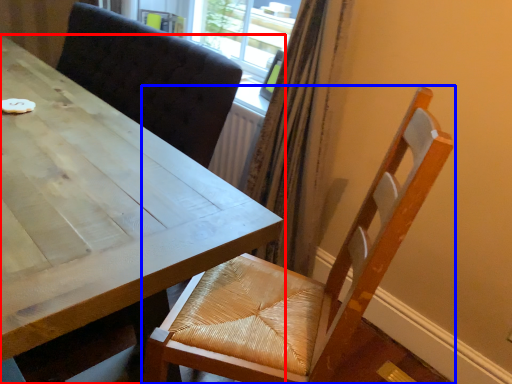
Question: Which of the following is the closest to the observer, table (highlighted by a red box) or chair (highlighted by a blue box)?

Choices:
 (A) table
 (B) chair

Answer: (A)